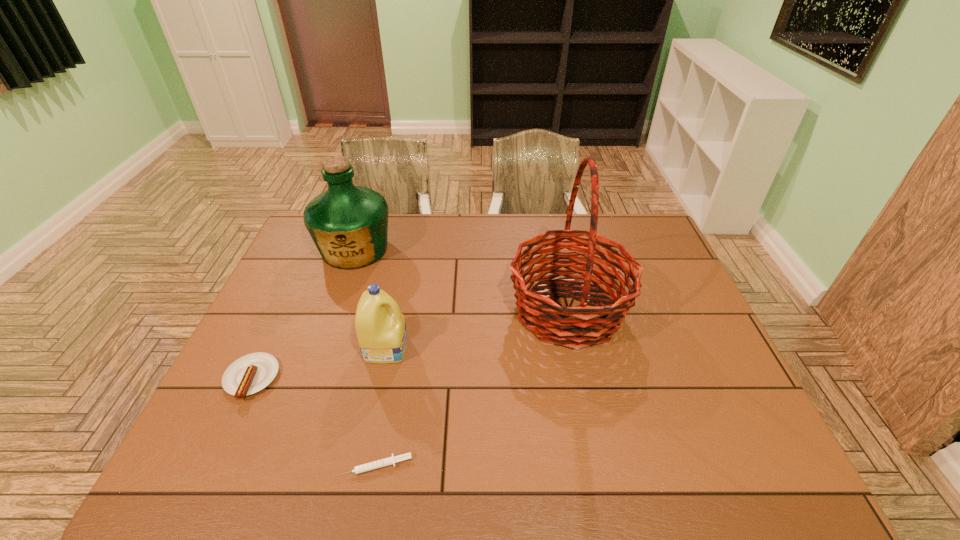
This screenshot has width=960, height=540. In order to click on vacant space at the right edge of the desktop in this screenshot , I will do `click(732, 381)`.

At what (x,y) coordinates should I click in order to perform the action: click on vacant area at the far right corner of the desktop. Please return your answer as a coordinate pair (x, y). The image size is (960, 540). Looking at the image, I should click on (655, 251).

The width and height of the screenshot is (960, 540). What are the coordinates of `empty space that is in between the tallest object and the sausage` in the screenshot? It's located at (410, 345).

Where is `free space between the shortest object and the second shortest object`? free space between the shortest object and the second shortest object is located at coordinates (313, 422).

Image resolution: width=960 pixels, height=540 pixels. I want to click on free space between the tallest object and the syringe, so click(471, 388).

Find the location of a particular element. The image size is (960, 540). unoccupied area between the sausage and the tallest object is located at coordinates (410, 345).

Image resolution: width=960 pixels, height=540 pixels. I want to click on empty space between the third tallest object and the syringe, so click(x=380, y=407).

Locate an element on the screen. The image size is (960, 540). free space between the detergent and the shortest object is located at coordinates (380, 407).

Locate an element on the screen. Image resolution: width=960 pixels, height=540 pixels. free spot between the liquor and the second shortest object is located at coordinates (303, 314).

Identify which object is the second nearest to the tallest object. Please provide its 2D coordinates. Your answer should be formatted as a tuple, i.e. [(x, y)], where the tuple contains the x and y coordinates of a point satisfying the conditions above.

[(388, 461)]